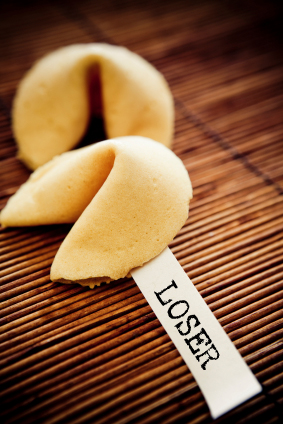
The height and width of the screenshot is (424, 283). In order to click on dark line along straw mat in this screenshot , I will do `click(279, 183)`, `click(84, 18)`.